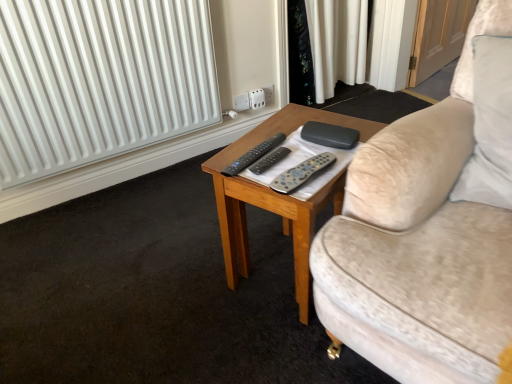
Where is `vacant space behind gray matte remote control at center, the 1th remote control viewed from the right`? This screenshot has width=512, height=384. vacant space behind gray matte remote control at center, the 1th remote control viewed from the right is located at coordinates (280, 135).